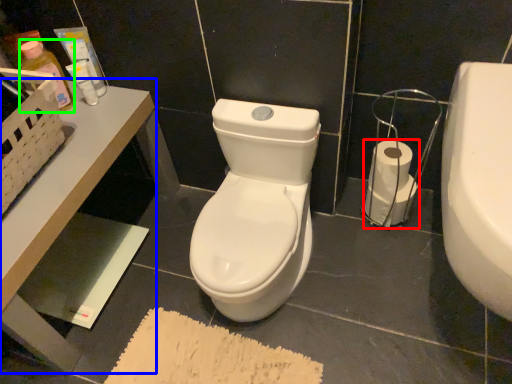
Question: Estimate the real-world distances between objects in this image. Which object is farther from toilet paper (highlighted by a red box), table (highlighted by a blue box) or toiletry (highlighted by a green box)?

Choices:
 (A) table
 (B) toiletry

Answer: (B)